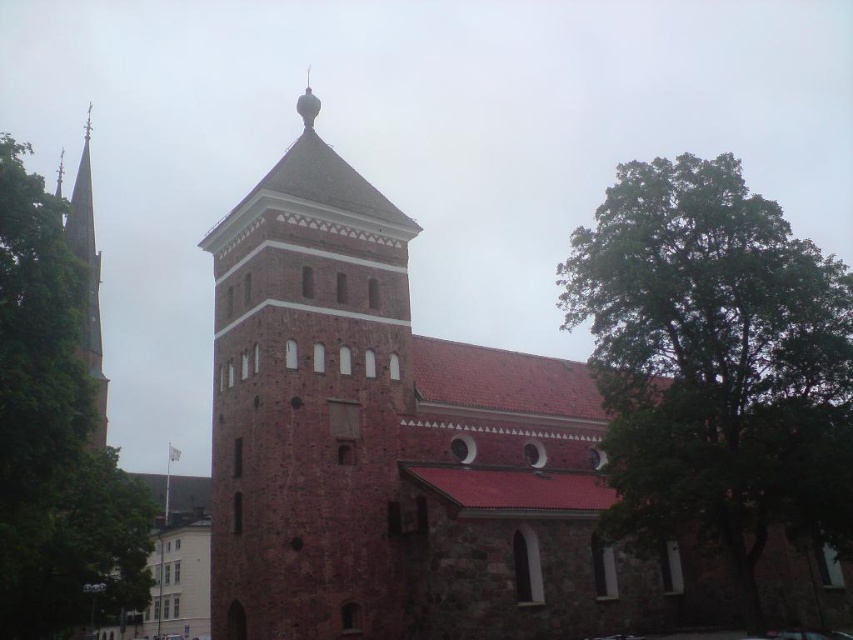
Can you confirm if red brick tower at center is positioned to the right of green leafy tree at left?

Correct, you'll find red brick tower at center to the right of green leafy tree at left.

Between point (378, 611) and point (119, 509), which one is positioned behind?

The point (119, 509) is behind.

Which is in front, point (392, 417) or point (21, 476)?

Point (21, 476)

Image resolution: width=853 pixels, height=640 pixels. What are the coordinates of `red brick tower at center` in the screenshot? It's located at (306, 400).

Can you confirm if brown stone church at center is smaller than green leafy tree at left?

Yes, brown stone church at center is smaller than green leafy tree at left.

Is point (309, 387) positioned behind point (20, 214)?

Yes.

The width and height of the screenshot is (853, 640). I want to click on brown stone church at center, so click(x=399, y=448).

Is green leafy tree at right positioned before green leafy tree at left?

No.

Is point (592, 272) positioned behind point (10, 280)?

Yes, it is behind point (10, 280).

Identify the location of green leafy tree at right. (715, 365).

Where is `green leafy tree at right`? This screenshot has height=640, width=853. green leafy tree at right is located at coordinates (715, 365).